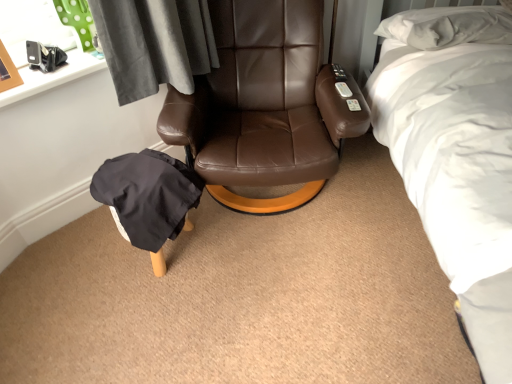
Question: Is white soft bed at upper right outside of black fabric bean bag chair at lower left?

Choices:
 (A) yes
 (B) no

Answer: (A)

Question: Could you tell me if white soft bed at upper right is turned towards black fabric bean bag chair at lower left?

Choices:
 (A) yes
 (B) no

Answer: (B)

Question: Is white soft bed at upper right turned away from black fabric bean bag chair at lower left?

Choices:
 (A) no
 (B) yes

Answer: (A)

Question: From a real-world perspective, is white soft bed at upper right physically above black fabric bean bag chair at lower left?

Choices:
 (A) yes
 (B) no

Answer: (A)

Question: From the image's perspective, is white soft bed at upper right below black fabric bean bag chair at lower left?

Choices:
 (A) no
 (B) yes

Answer: (A)

Question: From a real-world perspective, is black fabric bean bag chair at lower left positioned above or below brown leather chair at center?

Choices:
 (A) below
 (B) above

Answer: (A)

Question: From their relative heights in the image, would you say black fabric bean bag chair at lower left is taller or shorter than brown leather chair at center?

Choices:
 (A) short
 (B) tall

Answer: (A)

Question: Based on their sizes in the image, would you say black fabric bean bag chair at lower left is bigger or smaller than brown leather chair at center?

Choices:
 (A) small
 (B) big

Answer: (A)

Question: Do you think black fabric bean bag chair at lower left is within brown leather chair at center, or outside of it?

Choices:
 (A) inside
 (B) outside

Answer: (B)

Question: In the image, is brown leather chair at center on the left side or the right side of black fabric bean bag chair at lower left?

Choices:
 (A) left
 (B) right

Answer: (B)

Question: From the image's perspective, is brown leather chair at center above or below black fabric bean bag chair at lower left?

Choices:
 (A) above
 (B) below

Answer: (A)

Question: Based on their sizes in the image, would you say brown leather chair at center is bigger or smaller than black fabric bean bag chair at lower left?

Choices:
 (A) small
 (B) big

Answer: (B)

Question: In terms of height, does brown leather chair at center look taller or shorter compared to black fabric bean bag chair at lower left?

Choices:
 (A) short
 (B) tall

Answer: (B)

Question: From the image's perspective, is brown leather chair at center above or below white soft bed at upper right?

Choices:
 (A) above
 (B) below

Answer: (A)

Question: Looking at their shapes, would you say brown leather chair at center is wider or thinner than white soft bed at upper right?

Choices:
 (A) thin
 (B) wide

Answer: (A)